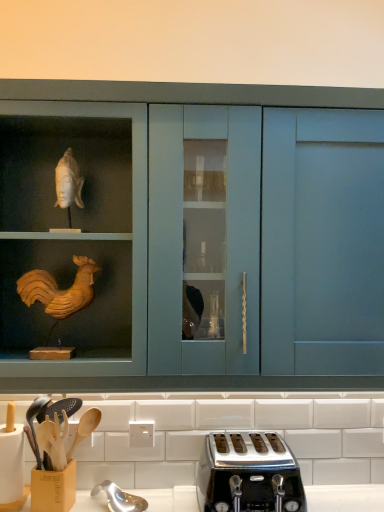
Question: Can you confirm if matte blue cabinet at center is taller than wooden utensil holder at lower left?

Choices:
 (A) yes
 (B) no

Answer: (A)

Question: Is matte blue cabinet at center smaller than wooden utensil holder at lower left?

Choices:
 (A) yes
 (B) no

Answer: (B)

Question: Is matte blue cabinet at center to the right of wooden utensil holder at lower left from the viewer's perspective?

Choices:
 (A) yes
 (B) no

Answer: (A)

Question: Could you tell me if matte blue cabinet at center is turned towards wooden utensil holder at lower left?

Choices:
 (A) yes
 (B) no

Answer: (B)

Question: Is matte blue cabinet at center not within wooden utensil holder at lower left?

Choices:
 (A) no
 (B) yes

Answer: (B)

Question: Considering the positions of point (211, 480) and point (9, 504), is point (211, 480) closer or farther from the camera than point (9, 504)?

Choices:
 (A) farther
 (B) closer

Answer: (A)

Question: In the image, is polished chrome toaster at lower center positioned in front of or behind wooden utensil holder at lower left?

Choices:
 (A) front
 (B) behind

Answer: (A)

Question: Choose the correct answer: Is polished chrome toaster at lower center inside wooden utensil holder at lower left or outside it?

Choices:
 (A) inside
 (B) outside

Answer: (B)

Question: Based on their positions, is polished chrome toaster at lower center located to the left or right of wooden utensil holder at lower left?

Choices:
 (A) left
 (B) right

Answer: (B)

Question: From the image's perspective, is matte blue cabinet at center located above or below polished chrome toaster at lower center?

Choices:
 (A) above
 (B) below

Answer: (A)

Question: Do you think matte blue cabinet at center is within polished chrome toaster at lower center, or outside of it?

Choices:
 (A) inside
 (B) outside

Answer: (B)

Question: From a real-world perspective, is matte blue cabinet at center positioned above or below polished chrome toaster at lower center?

Choices:
 (A) above
 (B) below

Answer: (A)

Question: Considering the relative positions of matte blue cabinet at center and polished chrome toaster at lower center in the image provided, is matte blue cabinet at center to the left or to the right of polished chrome toaster at lower center?

Choices:
 (A) right
 (B) left

Answer: (B)

Question: Considering the positions of wooden utensil holder at lower left and polished chrome toaster at lower center in the image, is wooden utensil holder at lower left taller or shorter than polished chrome toaster at lower center?

Choices:
 (A) short
 (B) tall

Answer: (B)

Question: Is wooden utensil holder at lower left inside or outside of polished chrome toaster at lower center?

Choices:
 (A) outside
 (B) inside

Answer: (A)